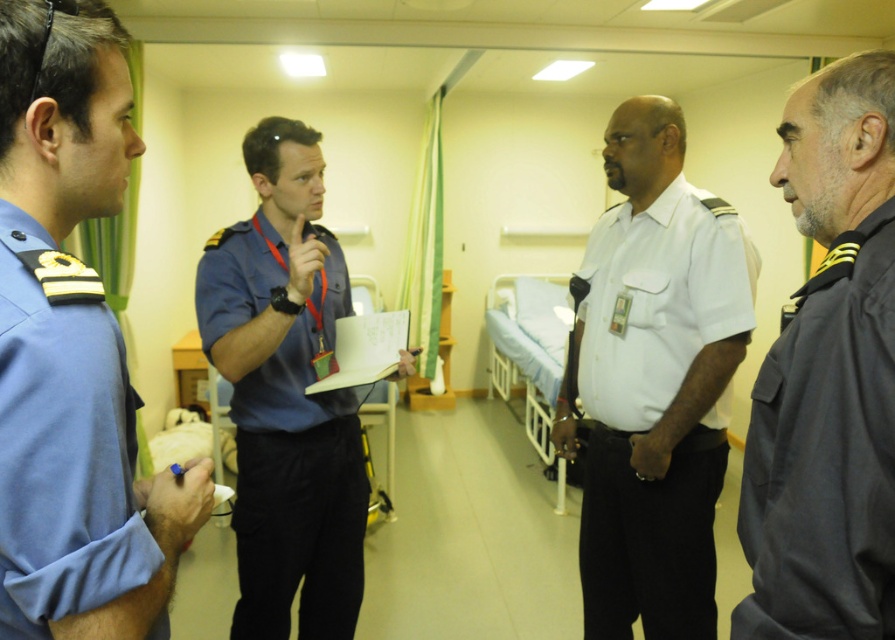
Question: Does blue uniform at left appear under white cotton shirt at center?

Choices:
 (A) no
 (B) yes

Answer: (A)

Question: Does dark gray cotton shirt at right lie in front of blue uniform at center?

Choices:
 (A) no
 (B) yes

Answer: (B)

Question: Among these points, which one is farthest from the camera?

Choices:
 (A) (245, 230)
 (B) (32, 385)
 (C) (709, 289)

Answer: (A)

Question: Which object appears farthest from the camera in this image?

Choices:
 (A) blue uniform at left
 (B) white cotton shirt at center
 (C) blue uniform at center
 (D) dark gray cotton shirt at right

Answer: (B)

Question: Estimate the real-world distances between objects in this image. Which object is closer to the white cotton shirt at center?

Choices:
 (A) blue uniform at center
 (B) blue uniform at left
 (C) dark gray cotton shirt at right

Answer: (A)

Question: Can you confirm if white cotton shirt at center is bigger than blue uniform at center?

Choices:
 (A) yes
 (B) no

Answer: (A)